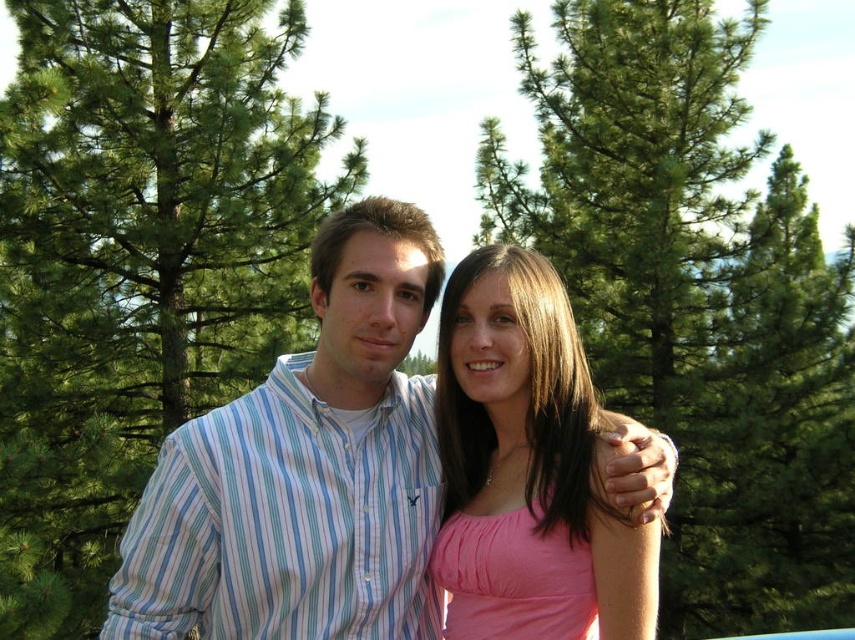
Question: Estimate the real-world distances between objects in this image. Which object is closer to the green leafy tree at center?

Choices:
 (A) pink satin dress at center
 (B) green needle-like tree at center
 (C) striped cotton shirt at center

Answer: (C)

Question: Considering the relative positions of green leafy tree at center and green needle-like tree at center in the image provided, where is green leafy tree at center located with respect to green needle-like tree at center?

Choices:
 (A) above
 (B) below

Answer: (A)

Question: Is green leafy tree at center above striped cotton shirt at center?

Choices:
 (A) yes
 (B) no

Answer: (A)

Question: Which object appears closest to the camera in this image?

Choices:
 (A) green leafy tree at center
 (B) green needle-like tree at center

Answer: (B)

Question: Estimate the real-world distances between objects in this image. Which object is closer to the green needle-like tree at center?

Choices:
 (A) green leafy tree at center
 (B) pink satin dress at center

Answer: (B)

Question: Does green leafy tree at center appear on the right side of striped cotton shirt at center?

Choices:
 (A) no
 (B) yes

Answer: (A)